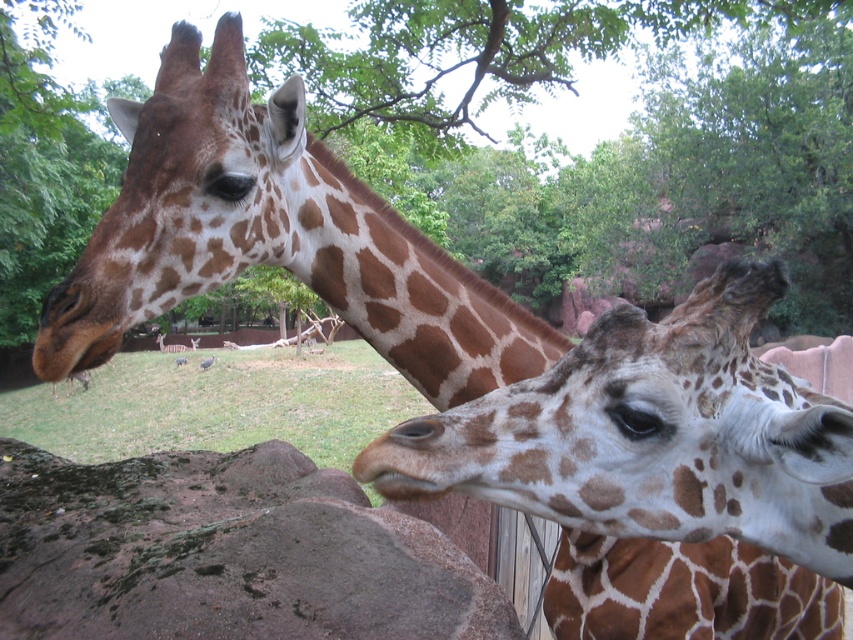
Can you confirm if spotted fur at center is thinner than brown rough rock at lower left?

Correct, spotted fur at center's width is less than brown rough rock at lower left's.

Does spotted fur at center appear on the left side of brown rough rock at lower left?

In fact, spotted fur at center is to the right of brown rough rock at lower left.

Who is more forward, (589, 384) or (154, 516)?

Positioned in front is point (589, 384).

This screenshot has height=640, width=853. I want to click on spotted fur at center, so tap(653, 435).